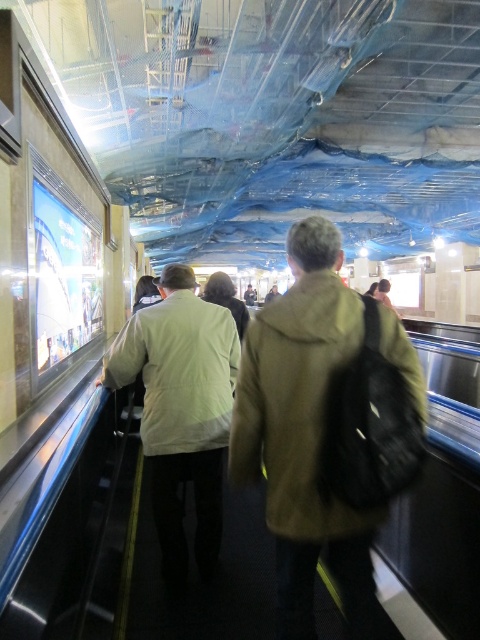
Measure the distance between brown woolen jacket at center and light beige jacket at center.

A distance of 35.21 inches exists between brown woolen jacket at center and light beige jacket at center.

Is brown woolen jacket at center above light beige jacket at center?

Correct, brown woolen jacket at center is located above light beige jacket at center.

You are a GUI agent. You are given a task and a screenshot of the screen. Output one action in this format:
    pyautogui.click(x=<x>, y=<y>)
    Task: Click on the brown woolen jacket at center
    
    Given the screenshot: What is the action you would take?
    pyautogui.click(x=295, y=403)

Identify the location of brown woolen jacket at center. This screenshot has width=480, height=640. (295, 403).